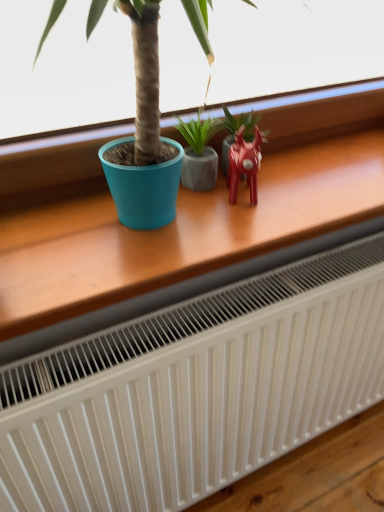
Question: Which direction should I rotate to look at glossy ceramic plant at center, the 1th houseplant positioned from the right, — up or down?

Choices:
 (A) down
 (B) up

Answer: (B)

Question: Does glossy plastic reindeer at center right have a lesser height compared to wooden table at center?

Choices:
 (A) yes
 (B) no

Answer: (A)

Question: Does glossy plastic reindeer at center right have a lesser width compared to wooden table at center?

Choices:
 (A) yes
 (B) no

Answer: (A)

Question: Is glossy plastic reindeer at center right outside of wooden table at center?

Choices:
 (A) yes
 (B) no

Answer: (B)

Question: Is glossy plastic reindeer at center right oriented away from wooden table at center?

Choices:
 (A) yes
 (B) no

Answer: (A)

Question: From the image's perspective, is glossy plastic reindeer at center right under wooden table at center?

Choices:
 (A) yes
 (B) no

Answer: (A)

Question: Is glossy plastic reindeer at center right surrounding wooden table at center?

Choices:
 (A) yes
 (B) no

Answer: (B)

Question: Is matte gray pot at center, which is counted as the first houseplant, starting from the left, bigger than wooden table at center?

Choices:
 (A) yes
 (B) no

Answer: (B)

Question: Is matte gray pot at center, which is counted as the first houseplant, starting from the left, smaller than wooden table at center?

Choices:
 (A) no
 (B) yes

Answer: (B)

Question: Can you confirm if matte gray pot at center, the 2th houseplant when ordered from right to left, is thinner than wooden table at center?

Choices:
 (A) no
 (B) yes

Answer: (B)

Question: From a real-world perspective, is matte gray pot at center, the 2th houseplant when ordered from right to left, on top of wooden table at center?

Choices:
 (A) yes
 (B) no

Answer: (B)

Question: Can you confirm if matte gray pot at center, the 2th houseplant when ordered from right to left, is positioned to the right of wooden table at center?

Choices:
 (A) no
 (B) yes

Answer: (B)

Question: Is matte gray pot at center, the 2th houseplant when ordered from right to left, positioned with its back to wooden table at center?

Choices:
 (A) no
 (B) yes

Answer: (B)

Question: Is the position of wooden table at center less distant than that of glossy ceramic plant at center, the second houseplant when ordered from left to right?

Choices:
 (A) no
 (B) yes

Answer: (B)